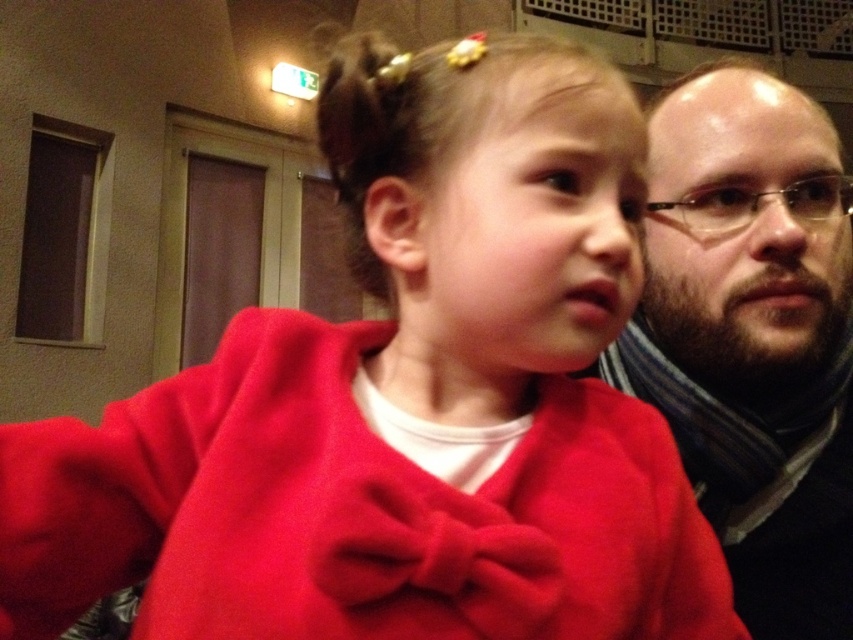
Question: Among these points, which one is nearest to the camera?

Choices:
 (A) (836, 374)
 (B) (711, 188)

Answer: (B)

Question: Does dark brown hair at upper right appear on the right side of clear plastic glasses at right?

Choices:
 (A) no
 (B) yes

Answer: (A)

Question: Is dark brown hair at upper right to the left of clear plastic glasses at right from the viewer's perspective?

Choices:
 (A) no
 (B) yes

Answer: (B)

Question: Among these points, which one is farthest from the camera?

Choices:
 (A) (843, 198)
 (B) (782, 604)

Answer: (A)

Question: Does dark brown hair at upper right appear on the left side of clear plastic glasses at right?

Choices:
 (A) no
 (B) yes

Answer: (B)